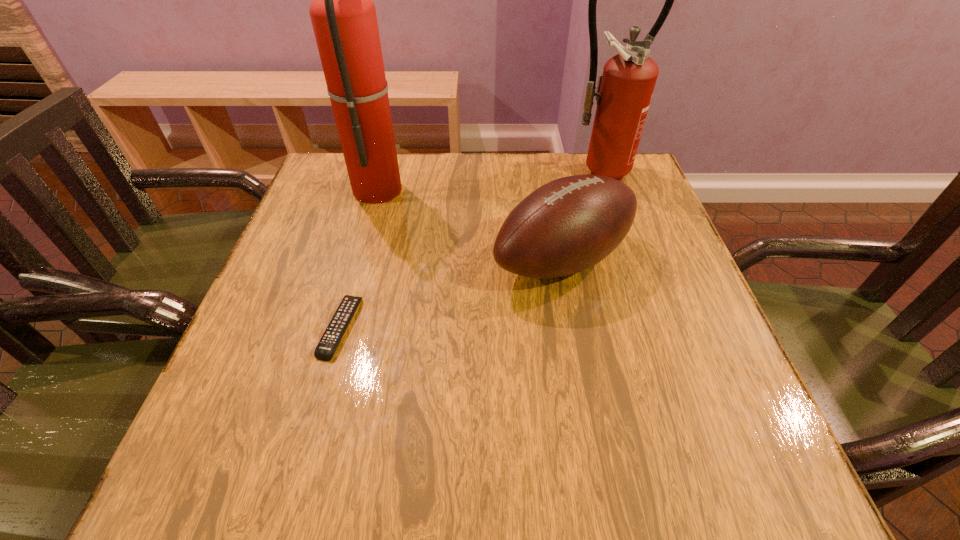
Find the location of a particular element. This screenshot has height=540, width=960. blank region between the shortest object and the left fire extinguisher is located at coordinates (359, 258).

Identify the location of unoccupied position between the left fire extinguisher and the right fire extinguisher. Image resolution: width=960 pixels, height=540 pixels. (487, 179).

Locate an element on the screen. The width and height of the screenshot is (960, 540). free space between the right fire extinguisher and the remote control is located at coordinates (468, 249).

This screenshot has height=540, width=960. In order to click on blank region between the remote control and the right fire extinguisher in this screenshot , I will do `click(468, 249)`.

This screenshot has width=960, height=540. What are the coordinates of `vacant area between the football (American) and the left fire extinguisher` in the screenshot? It's located at (470, 224).

The height and width of the screenshot is (540, 960). What are the coordinates of `vacant space in between the left fire extinguisher and the shortest object` in the screenshot? It's located at (359, 258).

You are a GUI agent. You are given a task and a screenshot of the screen. Output one action in this format:
    pyautogui.click(x=<x>, y=<y>)
    Task: Click on the blank region between the football (American) and the left fire extinguisher
    This screenshot has height=540, width=960.
    Given the screenshot: What is the action you would take?
    pyautogui.click(x=470, y=224)

This screenshot has height=540, width=960. Find the location of `free spot between the shortest object and the left fire extinguisher`. free spot between the shortest object and the left fire extinguisher is located at coordinates (359, 258).

The height and width of the screenshot is (540, 960). What are the coordinates of `free space between the left fire extinguisher and the right fire extinguisher` in the screenshot? It's located at (487, 179).

Point out which object is positioned as the nearest to the third tallest object. Please provide its 2D coordinates. Your answer should be formatted as a tuple, i.e. [(x, y)], where the tuple contains the x and y coordinates of a point satisfying the conditions above.

[(624, 91)]